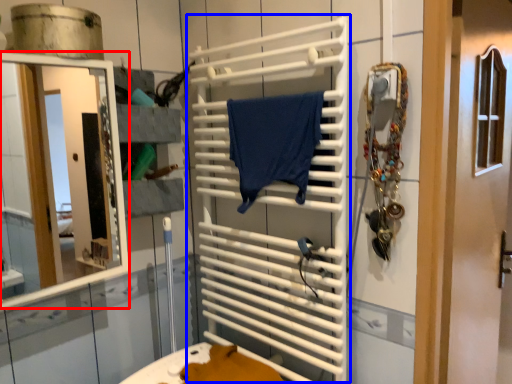
Question: Among these objects, which one is nearest to the camera, mirror (highlighted by a red box) or cage (highlighted by a blue box)?

Choices:
 (A) mirror
 (B) cage

Answer: (A)